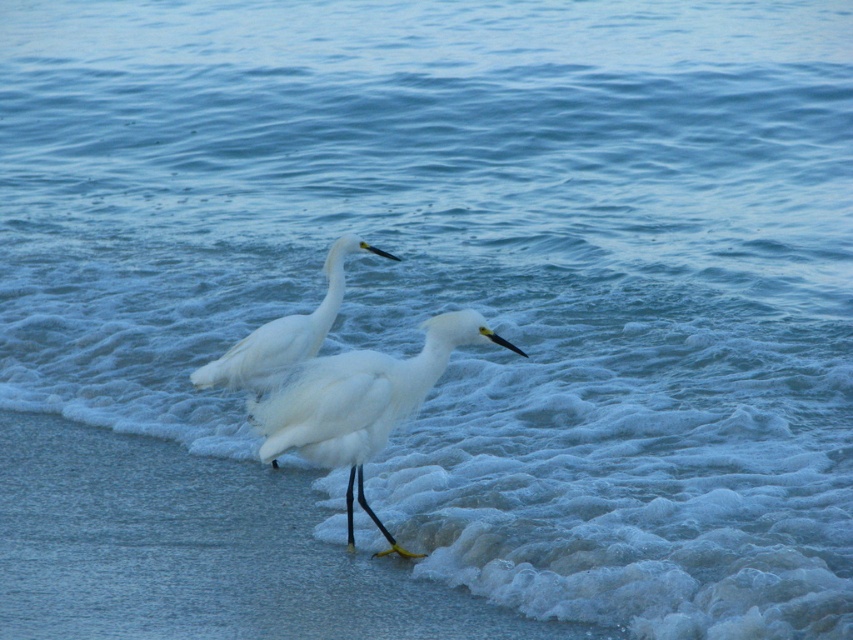
You are observing two white birds at a lakeside. You notice a white fluffy bird at center and a white feathered bird at center. Which one is more to the right?

The white fluffy bird at center is positioned on the right side of the white feathered bird at center, so the white fluffy bird at center is more to the right.

You are a birdwatcher observing two white birds near the water. You notice a point marked at coordinates (x=360, y=403). Which bird does this point correspond to?

The point at (x=360, y=403) corresponds to the white fluffy bird at center.